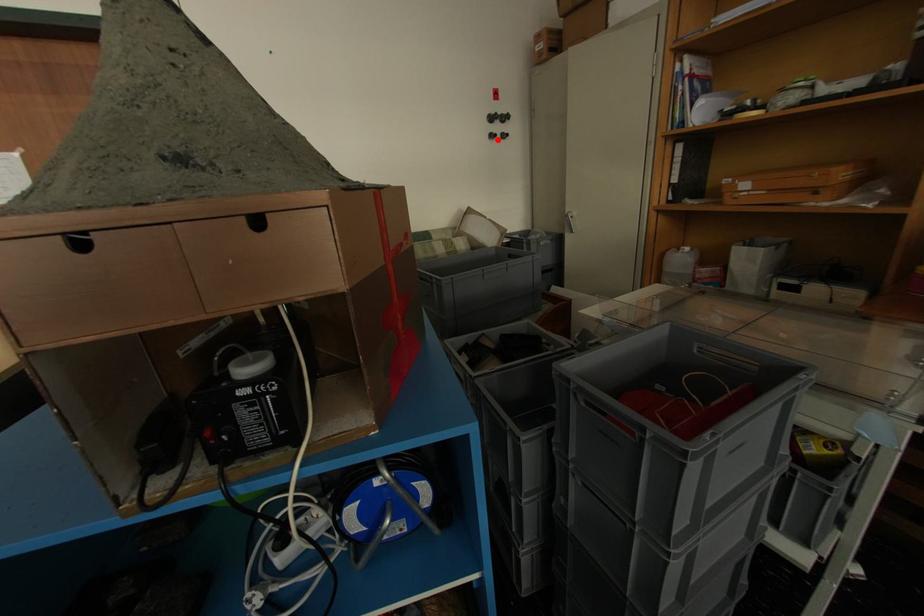
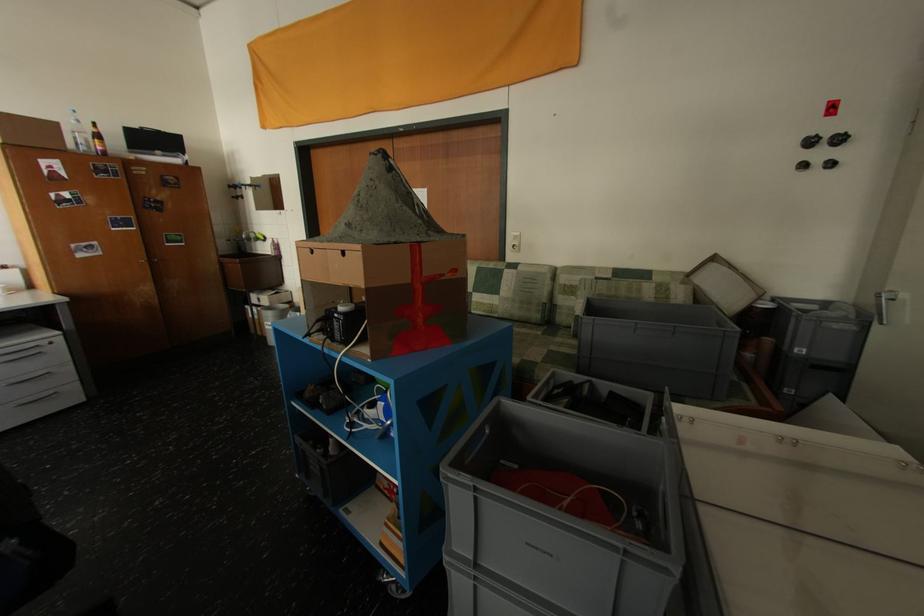
Question: I am providing you with two images of the same scene from different viewpoints. A red point is marked on the first image. Is the red point's position out of view in image 2?

Choices:
 (A) Yes
 (B) No

Answer: (B)